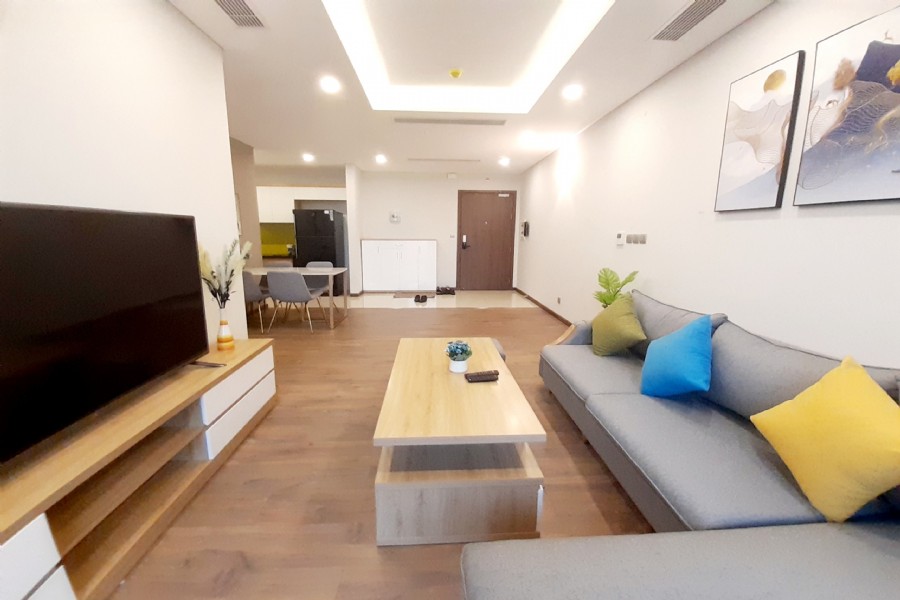
Find the location of a particular element. This screenshot has width=900, height=600. sofa seat cushion is located at coordinates (582, 368), (660, 430), (752, 579).